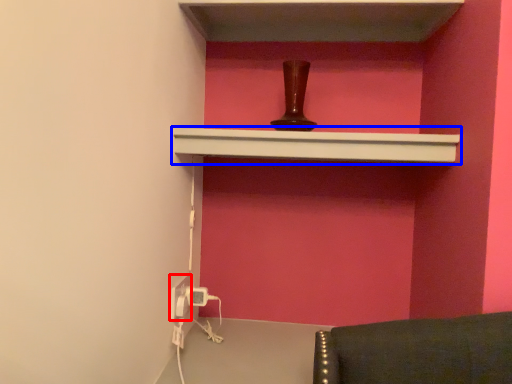
Question: Which object is further to the camera taking this photo, electric outlet (highlighted by a red box) or shelf (highlighted by a blue box)?

Choices:
 (A) electric outlet
 (B) shelf

Answer: (A)